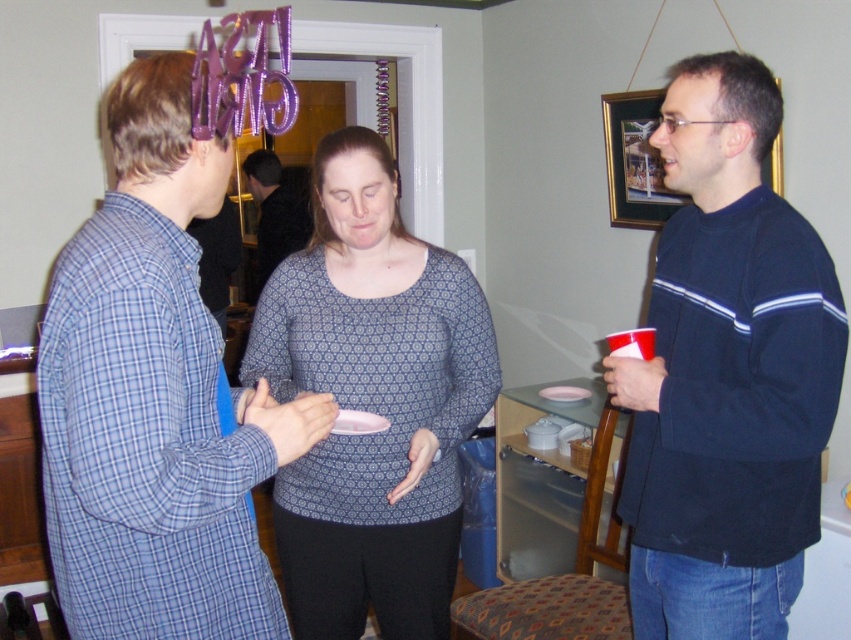
Question: Which of the following is the closest to the observer?

Choices:
 (A) (263, 164)
 (B) (334, 429)

Answer: (B)

Question: From the image, what is the correct spatial relationship of dark blue sweater at right in relation to patterned fabric blouse at center?

Choices:
 (A) left
 (B) right

Answer: (B)

Question: Can you confirm if blue plaid pajama at left is positioned to the left of patterned fabric shirt at center?

Choices:
 (A) no
 (B) yes

Answer: (A)

Question: Which point is closer to the camera taking this photo?

Choices:
 (A) (783, 278)
 (B) (160, 164)
 (C) (353, 433)

Answer: (B)

Question: Which of the following is the closest to the observer?

Choices:
 (A) (364, 428)
 (B) (732, 100)

Answer: (B)

Question: From the image, what is the correct spatial relationship of dark blue sweater at right in relation to patterned fabric blouse at center?

Choices:
 (A) right
 (B) left

Answer: (A)